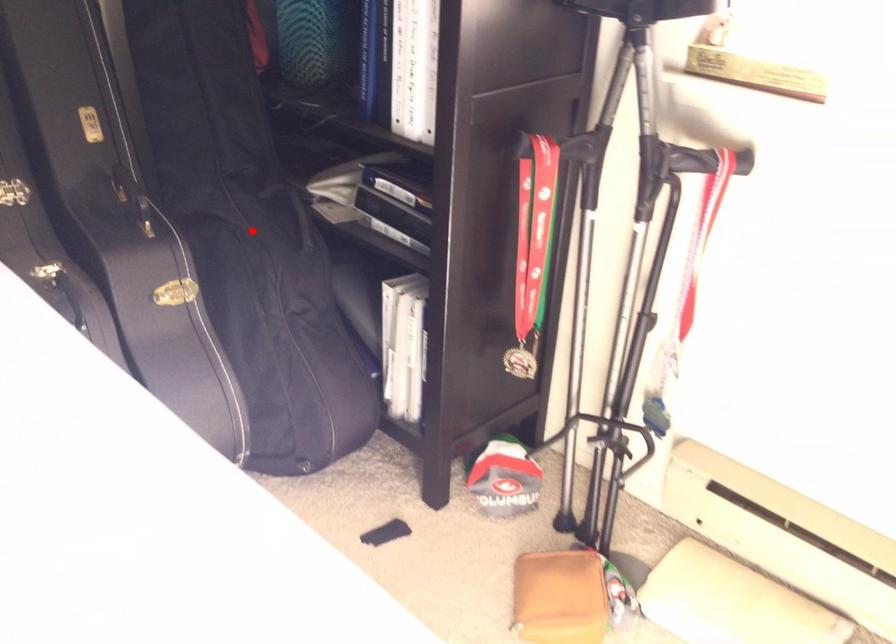
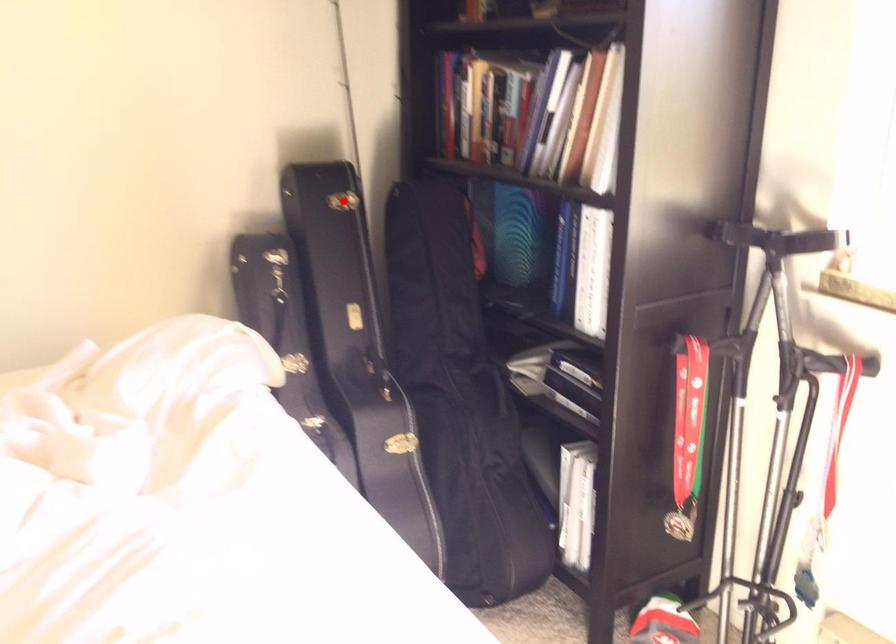
I am providing you with two images of the same scene from different viewpoints. A red point is marked on the first image and another point is marked on the second image. Is the marked point in image1 the same physical position as the marked point in image2?

No